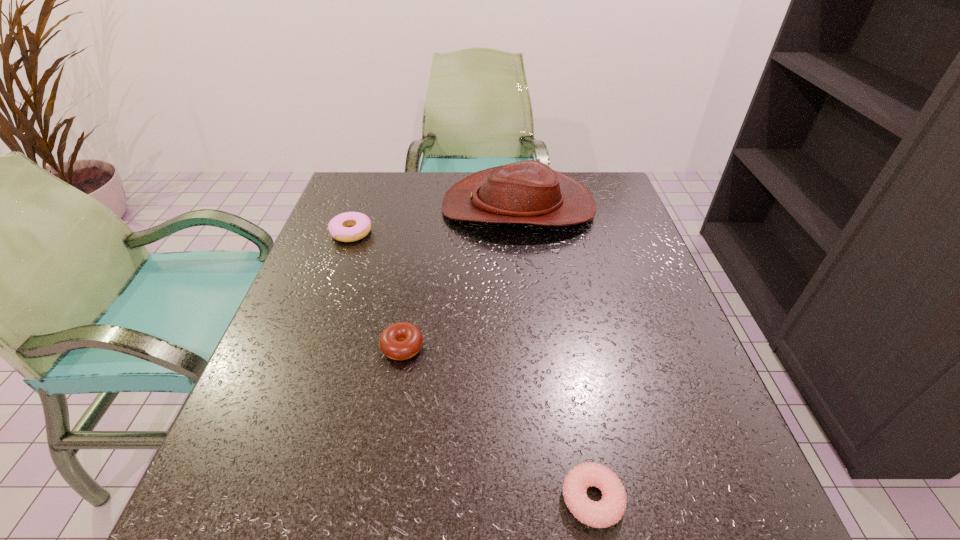
I want to click on vacant space at the left edge, so (x=282, y=390).

This screenshot has width=960, height=540. In the image, there is a desktop. Find the location of `vacant space at the right edge`. vacant space at the right edge is located at coordinates (618, 330).

Identify the location of vacant region at the far left corner of the desktop. This screenshot has height=540, width=960. (359, 210).

At what (x,y) coordinates should I click in order to perform the action: click on vacant area at the near left corner of the desktop. Please return your answer as a coordinate pair (x, y). Looking at the image, I should click on (305, 517).

Locate an element on the screen. vacant space at the far right corner of the desktop is located at coordinates (620, 200).

The image size is (960, 540). I want to click on free space between the third farthest object and the leftmost object, so click(x=377, y=289).

Locate an element on the screen. Image resolution: width=960 pixels, height=540 pixels. free space between the third farthest object and the tallest object is located at coordinates click(460, 277).

You are a GUI agent. You are given a task and a screenshot of the screen. Output one action in this format:
    pyautogui.click(x=<x>, y=<y>)
    Task: Click on the free spot between the farthest doughnut and the rightmost doughnut
    The width and height of the screenshot is (960, 540).
    Given the screenshot: What is the action you would take?
    pyautogui.click(x=472, y=366)

Where is `free space between the tallest object and the farthest doughnut`? The height and width of the screenshot is (540, 960). free space between the tallest object and the farthest doughnut is located at coordinates (435, 220).

In order to click on free spot between the nearest object and the second nearest doughnut in this screenshot , I will do `click(497, 423)`.